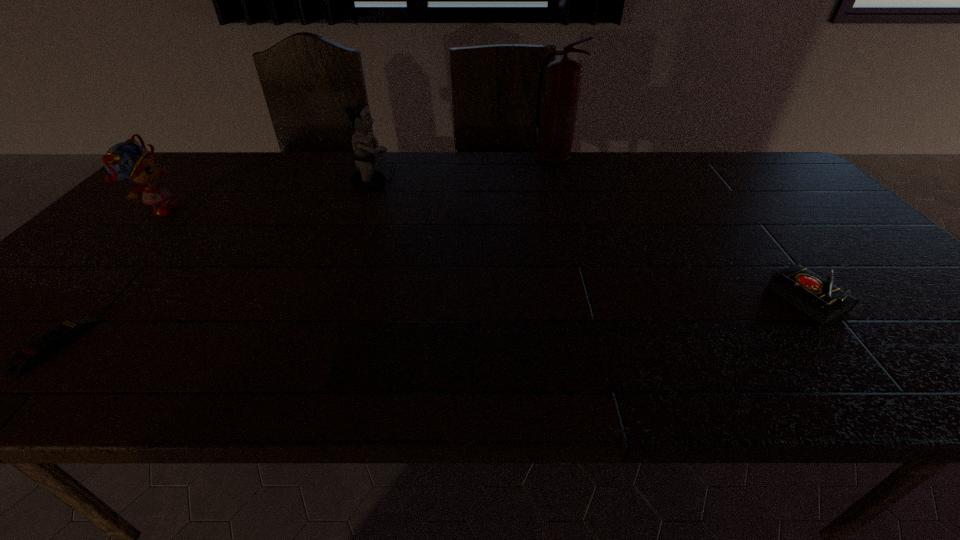
Find the location of a particular element. free space between the second tallest object and the third tallest object is located at coordinates (265, 198).

This screenshot has height=540, width=960. What are the coordinates of `free spot between the rightmost object and the third shortest object` in the screenshot? It's located at (482, 255).

Where is `free space between the figurine and the rightmost object`? This screenshot has width=960, height=540. free space between the figurine and the rightmost object is located at coordinates (589, 241).

Locate an element on the screen. free spot between the second tallest object and the tallest object is located at coordinates (463, 173).

Find the location of a particular element. The height and width of the screenshot is (540, 960). free point between the diary and the third object from right to left is located at coordinates (589, 241).

You are a GUI agent. You are given a task and a screenshot of the screen. Output one action in this format:
    pyautogui.click(x=<x>, y=<y>)
    Task: Click on the free spot between the third object from right to left and the diary
    This screenshot has width=960, height=540.
    Given the screenshot: What is the action you would take?
    pyautogui.click(x=589, y=241)

Identify which object is the second nearest to the fourth tallest object. Please provide its 2D coordinates. Your answer should be formatted as a tuple, i.e. [(x, y)], where the tuple contains the x and y coordinates of a point satisfying the conditions above.

[(367, 179)]

Find the location of a particular element. Image resolution: width=960 pixels, height=540 pixels. the fourth closest object to the third shortest object is located at coordinates (819, 299).

What are the coordinates of `free location that satisfies the following two spatial constraints: 1. on the face of the third tallest object; 2. on the right side of the second shortest object` in the screenshot? It's located at (69, 299).

Locate an element on the screen. The image size is (960, 540). free location that satisfies the following two spatial constraints: 1. on the front-facing side of the rightmost object; 2. on the left side of the third object from left to right is located at coordinates (329, 299).